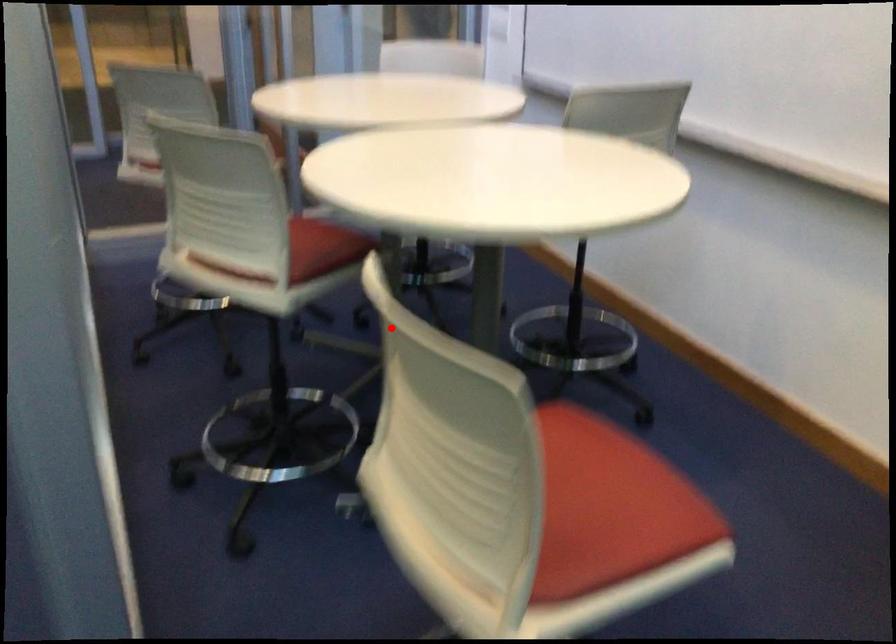
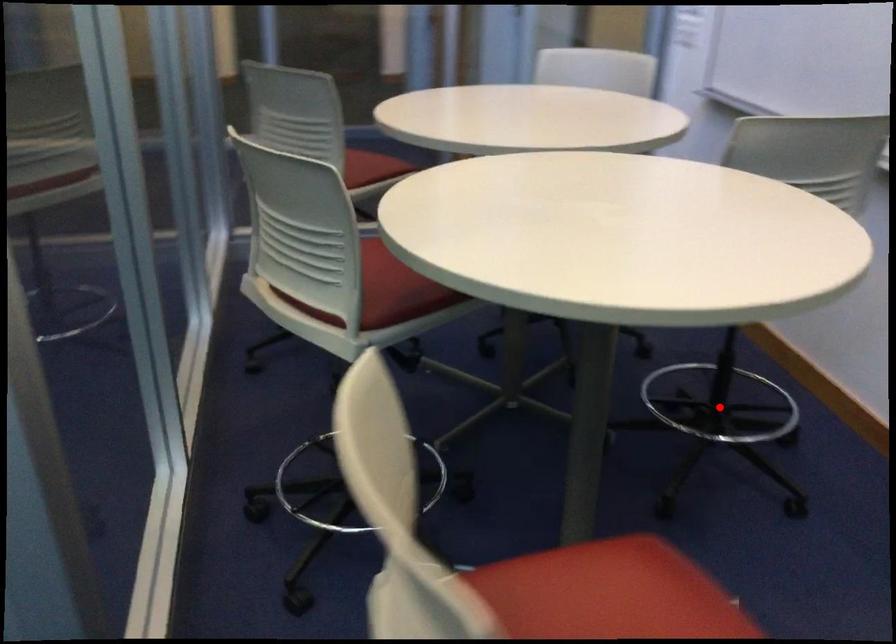
I am providing you with two images of the same scene from different viewpoints. A red point is marked on the first image and another point is marked on the second image. Are the points marked in image1 and image2 representing the same 3D position?

No